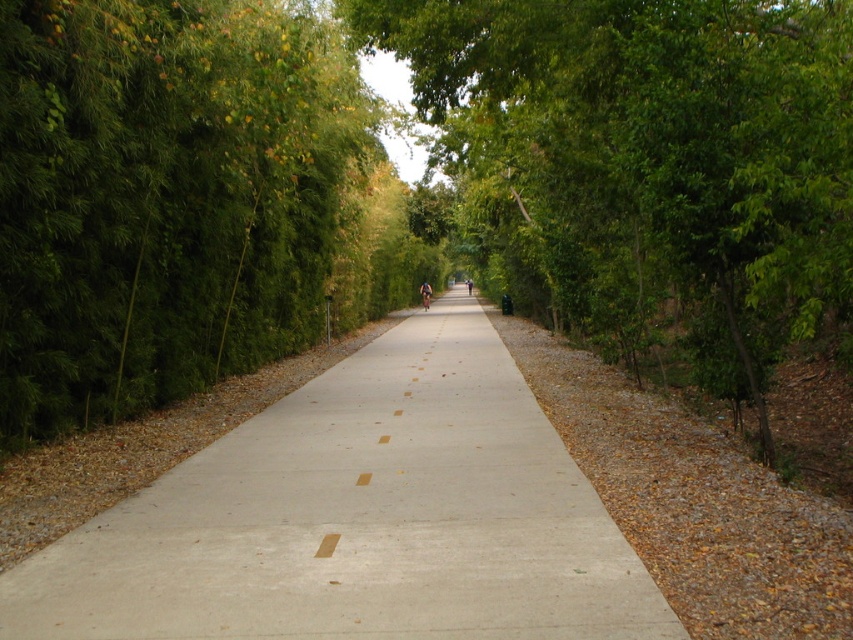
Is concrete at center further to camera compared to blue fabric cyclist at center?

That is False.

Which is above, concrete at center or blue fabric cyclist at center?

Positioned higher is blue fabric cyclist at center.

Between point (616, 637) and point (426, 300), which one is positioned in front?

Point (616, 637)

Locate an element on the screen. This screenshot has width=853, height=640. concrete at center is located at coordinates (358, 518).

The width and height of the screenshot is (853, 640). Describe the element at coordinates (358, 518) in the screenshot. I see `concrete at center` at that location.

Between point (274, 419) and point (469, 284), which one is positioned in front?

Point (274, 419)

Where is `concrete at center`? The height and width of the screenshot is (640, 853). concrete at center is located at coordinates (358, 518).

Between blue fabric cyclist at center and dark blue shirt at center, which one appears on the left side from the viewer's perspective?

blue fabric cyclist at center

In the scene shown: Which of these two, blue fabric cyclist at center or dark blue shirt at center, stands shorter?

Standing shorter between the two is dark blue shirt at center.

Who is more forward, (425, 288) or (473, 284)?

Point (425, 288) is more forward.

I want to click on blue fabric cyclist at center, so click(425, 294).